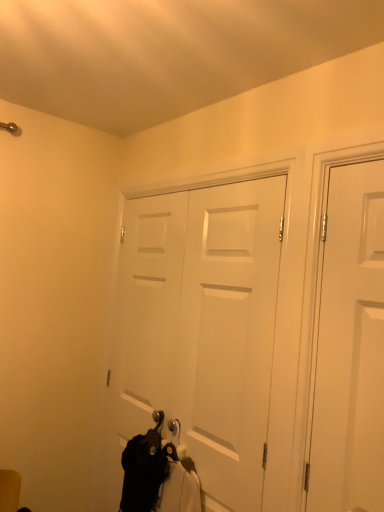
Question: From a real-world perspective, is black fabric at lower center above or below white matte door at center, marked as the first door in a back-to-front arrangement?

Choices:
 (A) below
 (B) above

Answer: (A)

Question: Looking at the image, does black fabric at lower center seem bigger or smaller compared to white matte door at center, which is the 1th door in left-to-right order?

Choices:
 (A) big
 (B) small

Answer: (B)

Question: Estimate the real-world distances between objects in this image. Which object is closer to the white matte door at center, acting as the 2th door starting from the right?

Choices:
 (A) white matte door at right, placed as the first door when sorted from front to back
 (B) black fabric at lower center

Answer: (B)

Question: Estimate the real-world distances between objects in this image. Which object is farther from the black fabric at lower center?

Choices:
 (A) white matte door at center, acting as the 2th door starting from the right
 (B) white matte door at right, positioned as the 1th door in right-to-left order

Answer: (B)